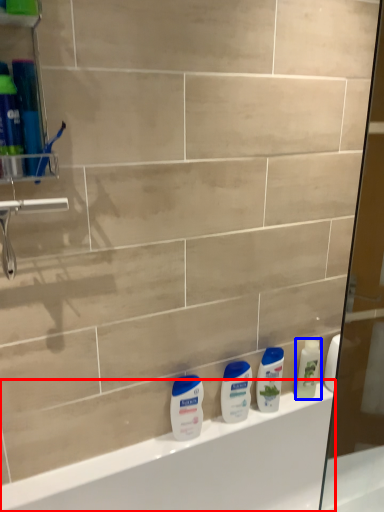
Question: Which object is further to the camera taking this photo, bathtub (highlighted by a red box) or cleaning product (highlighted by a blue box)?

Choices:
 (A) bathtub
 (B) cleaning product

Answer: (B)